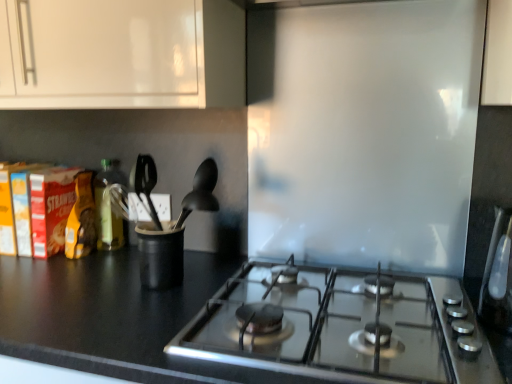
You are a GUI agent. You are given a task and a screenshot of the screen. Output one action in this format:
    pyautogui.click(x=<x>, y=<y>)
    Task: Click on the free spot above black matte countertop at lower left (from a real-world perspective)
    Image resolution: width=512 pixels, height=384 pixels.
    Given the screenshot: What is the action you would take?
    pyautogui.click(x=233, y=308)